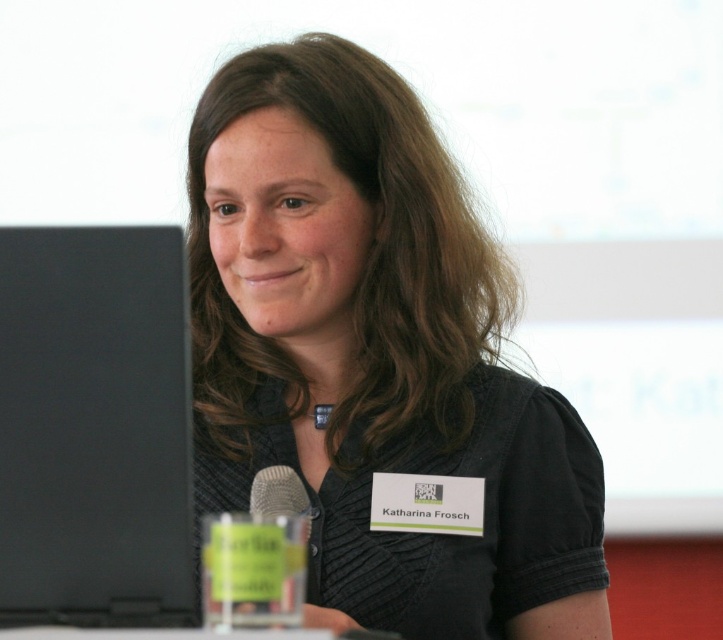
Who is taller, black matte laptop at left or silver metallic microphone at lower left?

black matte laptop at left

Is point (89, 429) positioned after point (299, 508)?

No, it is in front of (299, 508).

Which is in front, point (4, 236) or point (257, 499)?

Point (4, 236) is in front.

Where is `black matte laptop at left`? This screenshot has width=723, height=640. black matte laptop at left is located at coordinates (94, 428).

The width and height of the screenshot is (723, 640). What are the coordinates of `black matte shirt at center` in the screenshot? It's located at (375, 355).

Identify the location of black matte shirt at center. Image resolution: width=723 pixels, height=640 pixels. (375, 355).

Can you confirm if black matte shirt at center is thinner than black matte laptop at left?

No, black matte shirt at center is not thinner than black matte laptop at left.

Who is more forward, (369, 180) or (48, 564)?

Point (48, 564)

This screenshot has height=640, width=723. What are the coordinates of `black matte shirt at center` in the screenshot? It's located at (375, 355).